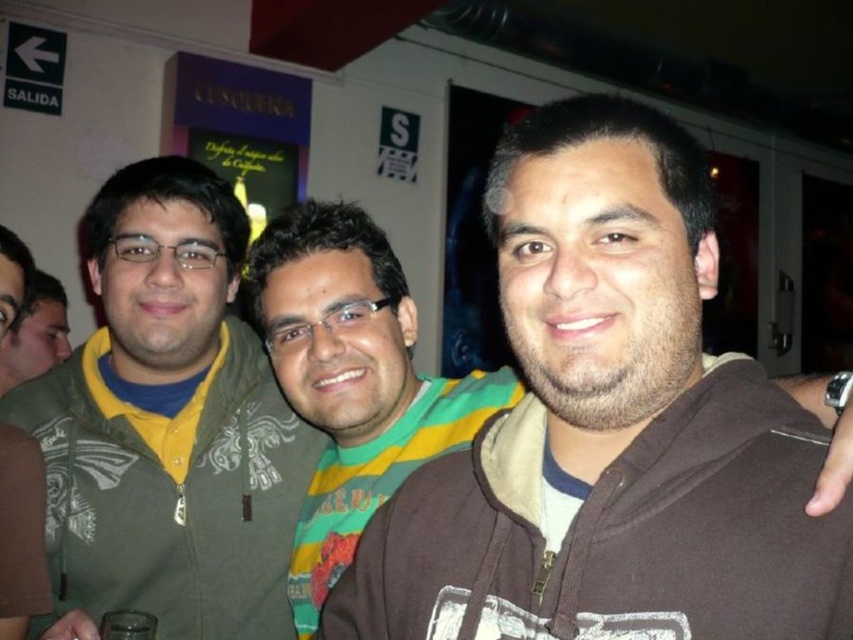
You are standing in a room and want to hand a drink to the person wearing the green textured hoodie at left and the brown fleece jacket at center. Which person should you approach first if you want to give the drink to the one closer to you?

You should approach the green textured hoodie at left first because it is closer to the viewer than the brown fleece jacket at center.

You are standing in front of the group of three people at the social gathering. You notice two points marked in the image. The first point is at coordinate (80, 484) and the second point is at coordinate (334, 456). Which of these two points is closer to you?

Point (80, 484) is closer to you because it is further to the viewer than point (334, 456).

You are a photographer trying to capture a group photo of the green textured hoodie at left and the brown fleece jacket at center. Since you want to ensure both subjects are in focus, you need to know their heights relative to each other. Which one is taller?

The green textured hoodie at left is much taller than the brown fleece jacket at center, so you should adjust the camera angle to account for the height difference to ensure both are in focus.